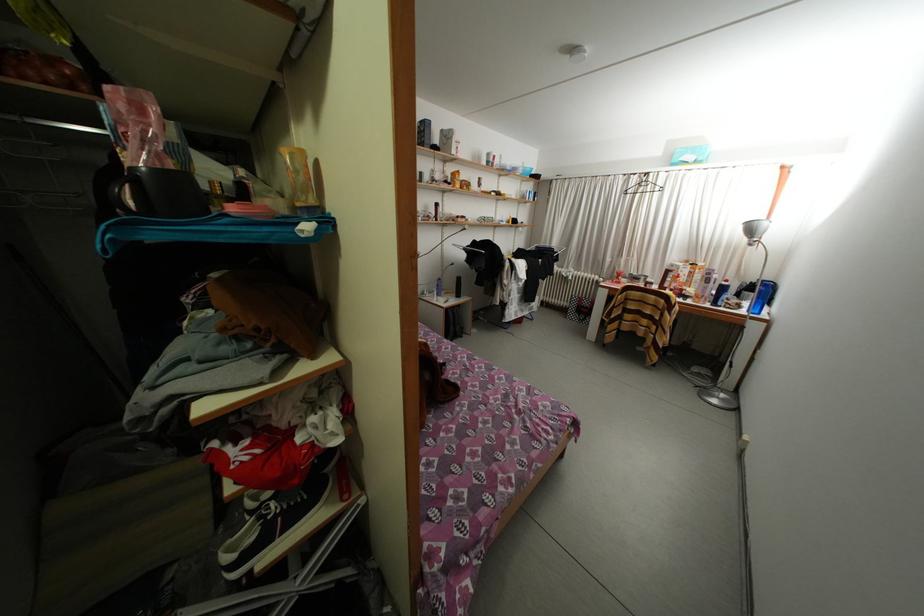
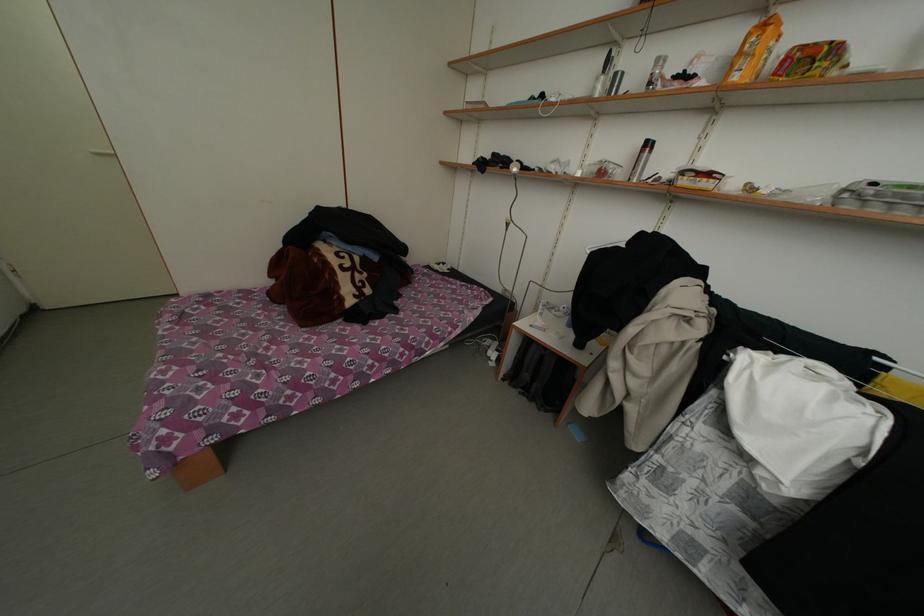
The point at (466, 177) is marked in the first image. Where is the corresponding point in the second image?

(774, 29)